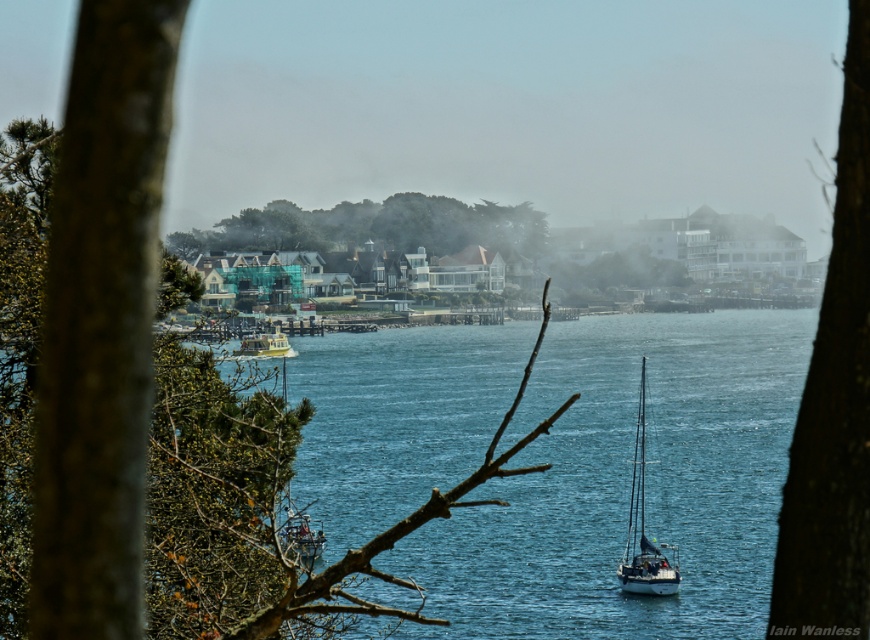
Question: Among these objects, which one is nearest to the camera?

Choices:
 (A) yellow matte boat at center
 (B) white glossy sailboat at center
 (C) blue water at center
 (D) green leafy tree at center

Answer: (C)

Question: Which object is farther from the camera taking this photo?

Choices:
 (A) blue water at center
 (B) green leafy tree at center

Answer: (B)

Question: Which object is closer to the camera taking this photo?

Choices:
 (A) brown rough bark tree at left
 (B) green leafy tree at center

Answer: (A)

Question: Does blue water at center appear over white glossy sailboat at center?

Choices:
 (A) yes
 (B) no

Answer: (A)

Question: Can you confirm if brown rough bark tree at left is smaller than metallic silver sailboat at center?

Choices:
 (A) no
 (B) yes

Answer: (B)

Question: Is blue water at center further to camera compared to white glossy sailboat at center?

Choices:
 (A) yes
 (B) no

Answer: (B)